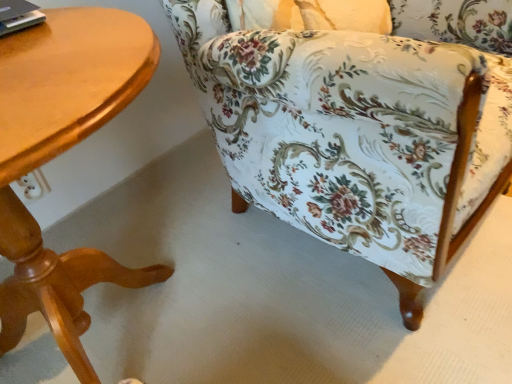
Question: Is wooden table at left smaller than floral fabric chair at center?

Choices:
 (A) yes
 (B) no

Answer: (A)

Question: Is wooden table at left facing towards floral fabric chair at center?

Choices:
 (A) no
 (B) yes

Answer: (A)

Question: Can you confirm if wooden table at left is taller than floral fabric chair at center?

Choices:
 (A) no
 (B) yes

Answer: (A)

Question: Are wooden table at left and floral fabric chair at center beside each other?

Choices:
 (A) no
 (B) yes

Answer: (A)

Question: Considering the relative sizes of wooden table at left and floral fabric chair at center in the image provided, is wooden table at left bigger than floral fabric chair at center?

Choices:
 (A) no
 (B) yes

Answer: (A)

Question: From a real-world perspective, is wooden table at left below floral fabric chair at center?

Choices:
 (A) yes
 (B) no

Answer: (A)

Question: Is floral fabric chair at center at the right side of wooden table at left?

Choices:
 (A) no
 (B) yes

Answer: (B)

Question: Is floral fabric chair at center closer to camera compared to wooden table at left?

Choices:
 (A) yes
 (B) no

Answer: (B)

Question: Is floral fabric chair at center taller than wooden table at left?

Choices:
 (A) yes
 (B) no

Answer: (A)

Question: From the image's perspective, is floral fabric chair at center located beneath wooden table at left?

Choices:
 (A) yes
 (B) no

Answer: (B)

Question: Is floral fabric chair at center facing away from wooden table at left?

Choices:
 (A) yes
 (B) no

Answer: (B)

Question: Does floral fabric chair at center have a lesser height compared to wooden table at left?

Choices:
 (A) yes
 (B) no

Answer: (B)

Question: Is floral fabric chair at center wider or thinner than wooden table at left?

Choices:
 (A) thin
 (B) wide

Answer: (B)